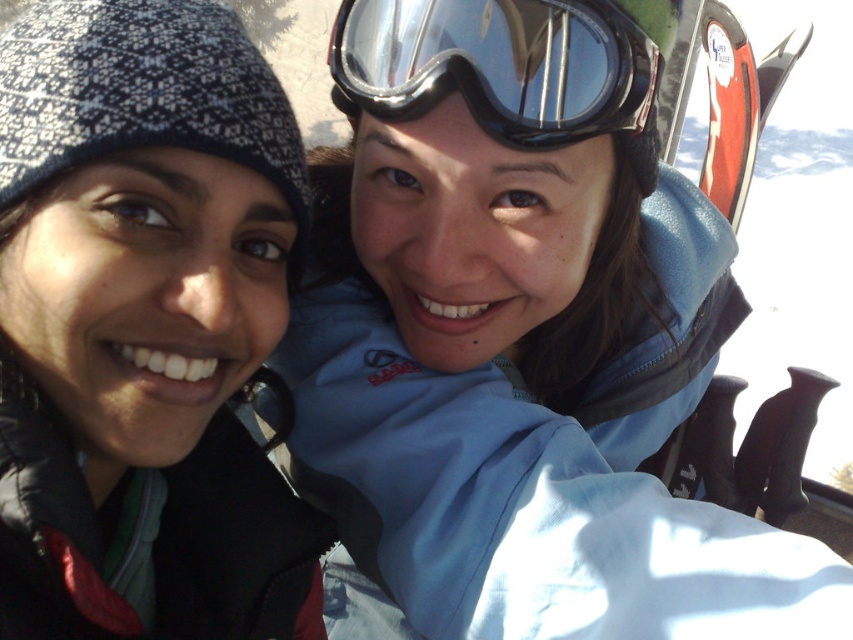
Question: Which of these objects is positioned closest to the red plastic ski at upper right?

Choices:
 (A) blue fabric jacket at center
 (B) black matte goggles at upper center
 (C) matte black beanie at upper left

Answer: (B)

Question: Does matte black beanie at upper left appear over red plastic ski at upper right?

Choices:
 (A) yes
 (B) no

Answer: (B)

Question: Which object appears closest to the camera in this image?

Choices:
 (A) matte black beanie at upper left
 (B) blue fabric jacket at center

Answer: (A)

Question: Is matte black beanie at upper left positioned in front of black matte goggles at upper center?

Choices:
 (A) yes
 (B) no

Answer: (A)

Question: Is blue fabric jacket at center to the left of black matte goggles at upper center from the viewer's perspective?

Choices:
 (A) yes
 (B) no

Answer: (B)

Question: Among these objects, which one is farthest from the camera?

Choices:
 (A) blue fabric jacket at center
 (B) matte black beanie at upper left
 (C) red plastic ski at upper right
 (D) black matte goggles at upper center

Answer: (C)